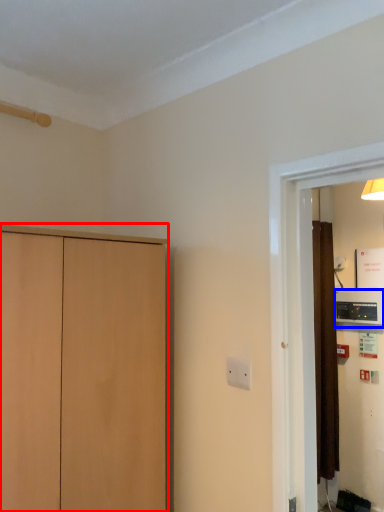
Question: Which object appears farthest to the camera in this image, cupboard (highlighted by a red box) or appliance (highlighted by a blue box)?

Choices:
 (A) cupboard
 (B) appliance

Answer: (B)